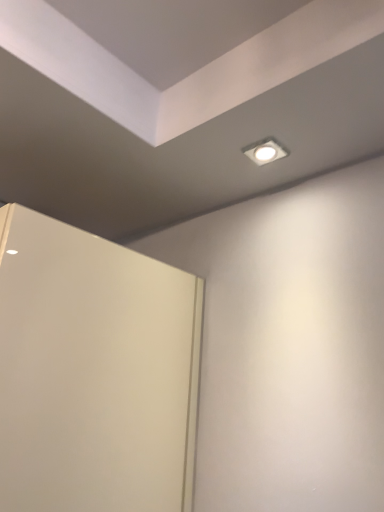
The height and width of the screenshot is (512, 384). In order to click on white matte door at left in this screenshot , I will do `click(94, 372)`.

What is the approximate height of white matte door at left?

white matte door at left is 3.32 feet in height.

Image resolution: width=384 pixels, height=512 pixels. Describe the element at coordinates (94, 372) in the screenshot. I see `white matte door at left` at that location.

This screenshot has height=512, width=384. In order to click on white glossy square light at upper center in this screenshot , I will do `click(265, 151)`.

Image resolution: width=384 pixels, height=512 pixels. What do you see at coordinates (265, 151) in the screenshot? I see `white glossy square light at upper center` at bounding box center [265, 151].

Locate an element on the screen. white matte door at left is located at coordinates (94, 372).

Which is more to the left, white glossy square light at upper center or white matte door at left?

white matte door at left is more to the left.

Which object is further away from the camera taking this photo, white glossy square light at upper center or white matte door at left?

white glossy square light at upper center.

Considering the points (280, 156) and (38, 344), which point is behind, point (280, 156) or point (38, 344)?

Point (280, 156)

Looking at this image, from the image's perspective, is white glossy square light at upper center above or below white matte door at left?

white glossy square light at upper center is situated higher than white matte door at left in the image.

From a real-world perspective, is white glossy square light at upper center positioned under white matte door at left based on gravity?

No.

Is white glossy square light at upper center wider or thinner than white matte door at left?

In the image, white glossy square light at upper center appears to be wider than white matte door at left.

Is white glossy square light at upper center taller or shorter than white matte door at left?

white glossy square light at upper center is shorter than white matte door at left.

Who is smaller, white glossy square light at upper center or white matte door at left?

white glossy square light at upper center is smaller.

Can we say white glossy square light at upper center lies outside white matte door at left?

Indeed, white glossy square light at upper center is completely outside white matte door at left.

Are white glossy square light at upper center and white matte door at left making contact?

They are not placed beside each other.

Could you tell me if white glossy square light at upper center is facing white matte door at left?

No.

What's the angular difference between white glossy square light at upper center and white matte door at left's facing directions?

The angular difference between white glossy square light at upper center and white matte door at left is 88 degrees.

Where is `lighting that is above the white matte door at left (from a real-world perspective)`? The width and height of the screenshot is (384, 512). lighting that is above the white matte door at left (from a real-world perspective) is located at coordinates (265, 151).

Considering the relative positions of white matte door at left and white glossy square light at upper center in the image provided, is white matte door at left to the right of white glossy square light at upper center from the viewer's perspective?

Incorrect, white matte door at left is not on the right side of white glossy square light at upper center.

Which object is closer to the camera taking this photo, white matte door at left or white glossy square light at upper center?

white matte door at left is closer to the camera.

Which is in front, point (63, 304) or point (266, 146)?

The point (63, 304) is closer to the camera.

From the image's perspective, is white matte door at left above or below white glossy square light at upper center?

Clearly, from the image's perspective, white matte door at left is below white glossy square light at upper center.

From a real-world perspective, is white matte door at left below white glossy square light at upper center?

Correct, in the physical world, white matte door at left is lower than white glossy square light at upper center.

Does white matte door at left have a lesser width compared to white glossy square light at upper center?

Yes, white matte door at left is thinner than white glossy square light at upper center.

Which of these two, white matte door at left or white glossy square light at upper center, stands taller?

Standing taller between the two is white matte door at left.

In terms of size, does white matte door at left appear bigger or smaller than white glossy square light at upper center?

Considering their sizes, white matte door at left takes up more space than white glossy square light at upper center.

Choose the correct answer: Is white matte door at left inside white glossy square light at upper center or outside it?

white matte door at left is spatially situated outside white glossy square light at upper center.

Would you say white matte door at left is a long distance from white glossy square light at upper center?

No, white matte door at left is in close proximity to white glossy square light at upper center.

Is white matte door at left aimed at white glossy square light at upper center?

No.

How many degrees apart are the facing directions of white matte door at left and white glossy square light at upper center?

The angle between the facing direction of white matte door at left and the facing direction of white glossy square light at upper center is 88 degrees.

How distant is white matte door at left from white glossy square light at upper center?

white matte door at left is 64.36 centimeters from white glossy square light at upper center.

Identify the location of lighting located above the white matte door at left (from the image's perspective). Image resolution: width=384 pixels, height=512 pixels. (265, 151).

Where is `lighting located above the white matte door at left (from the image's perspective)`? Image resolution: width=384 pixels, height=512 pixels. lighting located above the white matte door at left (from the image's perspective) is located at coordinates (265, 151).

I want to click on door below the white glossy square light at upper center (from a real-world perspective), so click(94, 372).